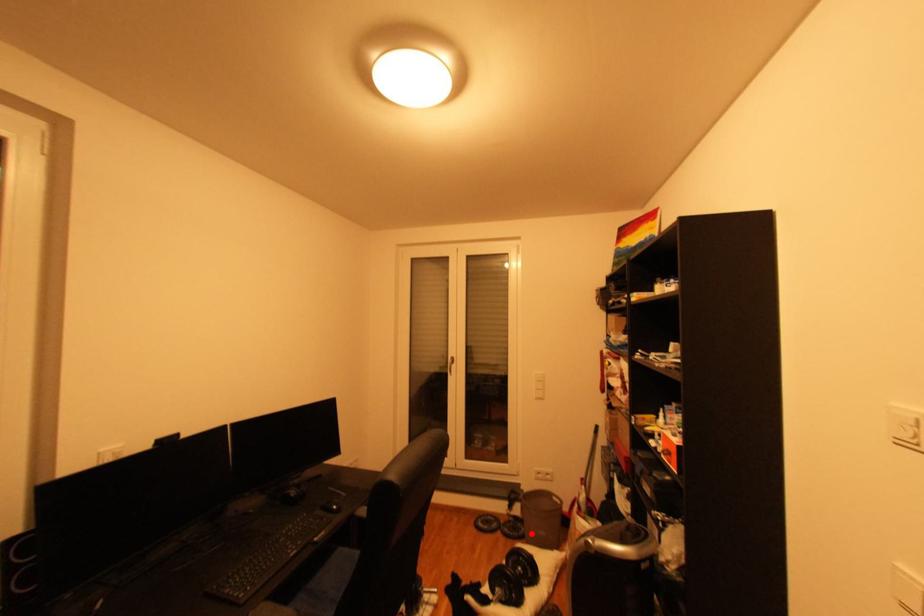
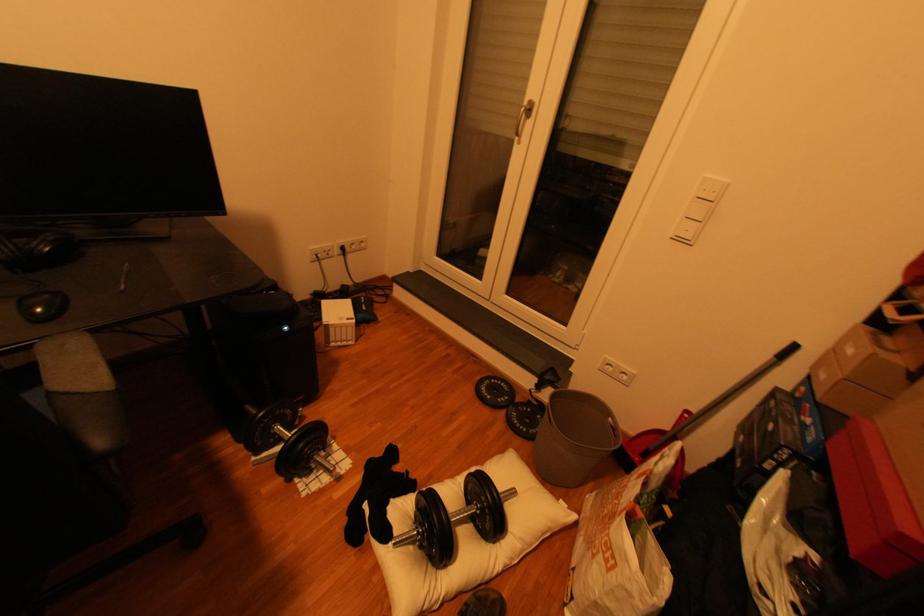
The point at the highlighted location is marked in the first image. Where is the corresponding point in the second image?

(543, 431)